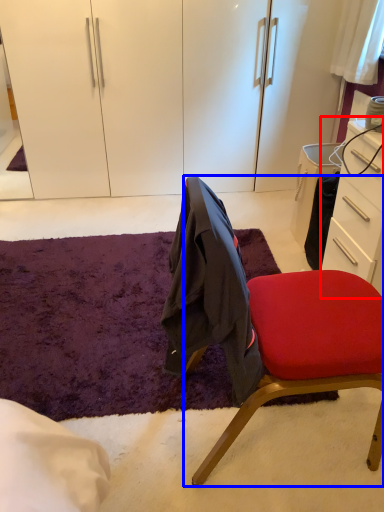
Question: Which point is closer to the camera, desk (highlighted by a red box) or chair (highlighted by a blue box)?

Choices:
 (A) desk
 (B) chair

Answer: (B)